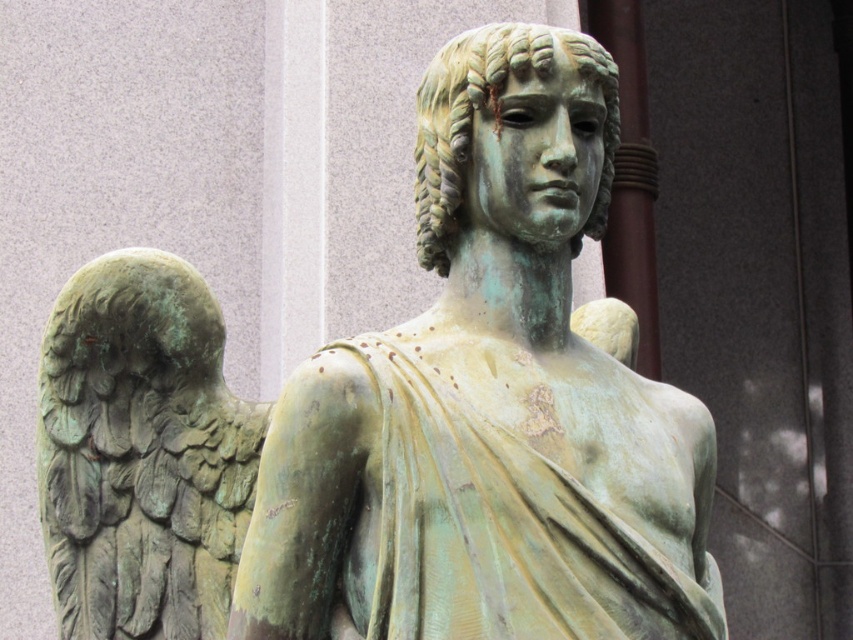
Question: Can you confirm if green patina statue at center is thinner than green patina wings at left?

Choices:
 (A) no
 (B) yes

Answer: (A)

Question: Is green patina statue at center wider than green patina wings at left?

Choices:
 (A) no
 (B) yes

Answer: (B)

Question: Which object is closer to the camera taking this photo?

Choices:
 (A) green patina statue at center
 (B) green patina wings at left

Answer: (A)

Question: Which object appears closest to the camera in this image?

Choices:
 (A) green patina statue at center
 (B) green patina wings at left

Answer: (A)

Question: Does green patina statue at center have a greater width compared to green patina wings at left?

Choices:
 (A) no
 (B) yes

Answer: (B)